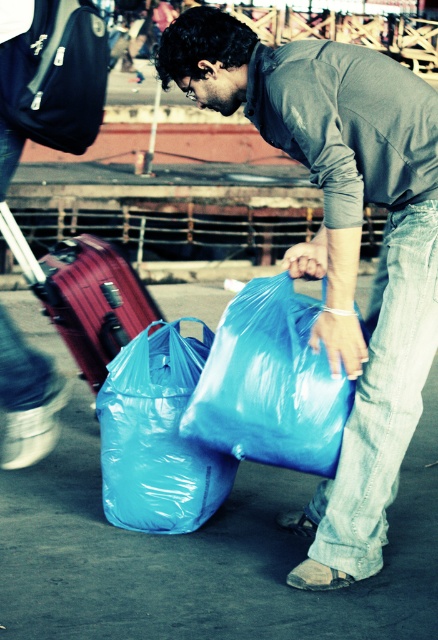
You are a security guard at the train station. You need to locate the jeans at lower right. Where exactly should you look on the platform?

You should look at point 0.622 on the horizontal axis and 0.874 on the vertical axis to find the jeans at lower right.

You are a photographer standing on the train station platform. You want to capture a photo of the jeans at lower right and the blue plastic bag at center. Which object will appear larger in the photo?

The jeans at lower right will appear larger in the photo because it is taller than the blue plastic bag at center.

You are a delivery person who needs to move a package from the jeans at lower right to the matte red suitcase at left. Given that your delivery robot has a maximum reach of 5 feet, will it be able to move the package without needing to move the robot itself?

The distance between the jeans at lower right and the matte red suitcase at left is 4.86 feet, which is within the robot s maximum reach of 5 feet. Therefore, the robot can move the package without needing to move its position.